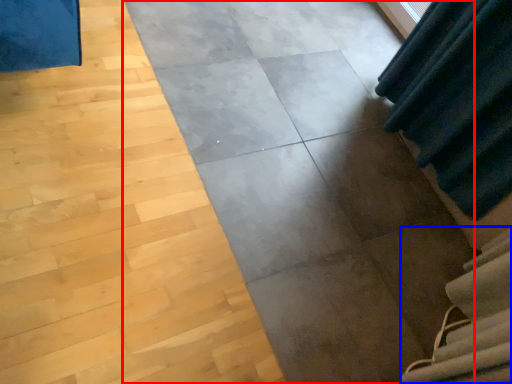
Question: Which object is closer to the camera taking this photo, concrete (highlighted by a red box) or stairwell (highlighted by a blue box)?

Choices:
 (A) concrete
 (B) stairwell

Answer: (A)